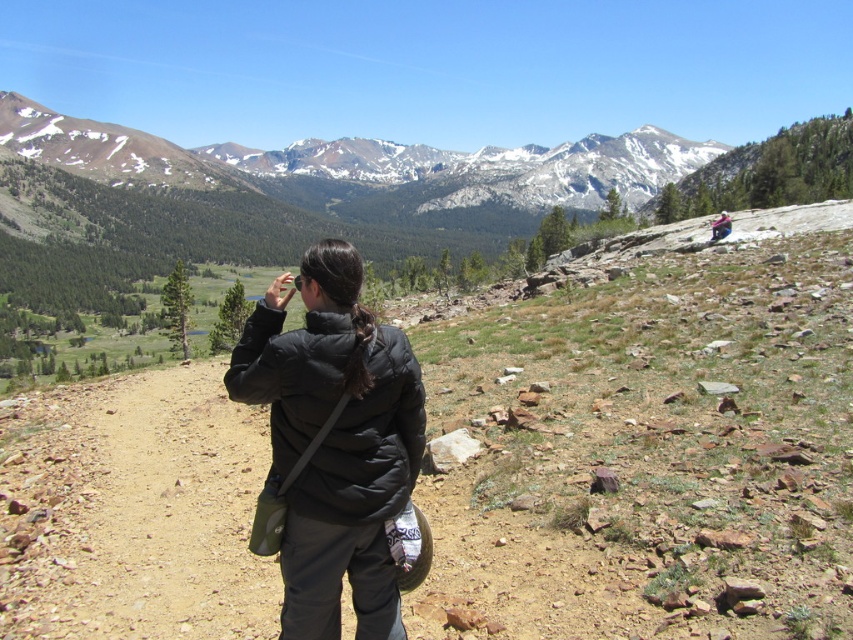
Question: Can you confirm if black puffer jacket at center is positioned above matte black jacket at upper right?

Choices:
 (A) no
 (B) yes

Answer: (A)

Question: Which point is farther from the camera taking this photo?

Choices:
 (A) (724, 221)
 (B) (363, 467)

Answer: (A)

Question: Is black puffer jacket at center positioned before matte black jacket at upper right?

Choices:
 (A) no
 (B) yes

Answer: (B)

Question: Considering the relative positions of black puffer jacket at center and matte black jacket at upper right in the image provided, where is black puffer jacket at center located with respect to matte black jacket at upper right?

Choices:
 (A) right
 (B) left

Answer: (B)

Question: Among these points, which one is nearest to the camera?

Choices:
 (A) (712, 228)
 (B) (225, 371)

Answer: (B)